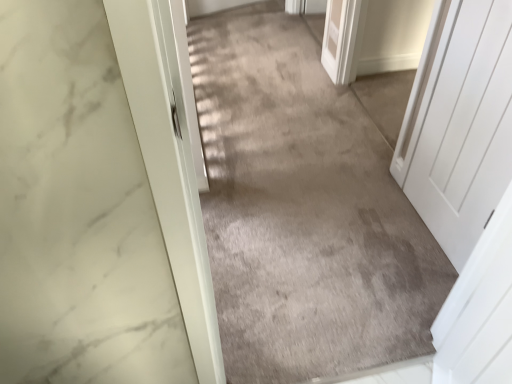
Question: Should I look upward or downward to see gray carpet at center?

Choices:
 (A) up
 (B) down

Answer: (A)

Question: Is gray carpet at center taller than white matte door at right?

Choices:
 (A) yes
 (B) no

Answer: (B)

Question: Can you confirm if gray carpet at center is wider than white matte door at right?

Choices:
 (A) no
 (B) yes

Answer: (B)

Question: Is gray carpet at center directly adjacent to white matte door at right?

Choices:
 (A) no
 (B) yes

Answer: (A)

Question: Is gray carpet at center smaller than white matte door at right?

Choices:
 (A) yes
 (B) no

Answer: (B)

Question: Could white matte door at right be considered to be inside gray carpet at center?

Choices:
 (A) yes
 (B) no

Answer: (B)

Question: From the image's perspective, would you say gray carpet at center is shown under white matte door at right?

Choices:
 (A) yes
 (B) no

Answer: (B)

Question: Considering the relative sizes of white matte door at right and gray carpet at center in the image provided, is white matte door at right smaller than gray carpet at center?

Choices:
 (A) no
 (B) yes

Answer: (B)

Question: Is white matte door at right oriented away from gray carpet at center?

Choices:
 (A) yes
 (B) no

Answer: (B)

Question: Does white matte door at right have a larger size compared to gray carpet at center?

Choices:
 (A) yes
 (B) no

Answer: (B)

Question: Can you confirm if white matte door at right is thinner than gray carpet at center?

Choices:
 (A) yes
 (B) no

Answer: (A)

Question: Is white matte door at right located outside gray carpet at center?

Choices:
 (A) no
 (B) yes

Answer: (B)

Question: Can you confirm if white matte door at right is taller than gray carpet at center?

Choices:
 (A) yes
 (B) no

Answer: (A)

Question: Considering their positions, is white matte door at right located in front of or behind gray carpet at center?

Choices:
 (A) behind
 (B) front

Answer: (B)